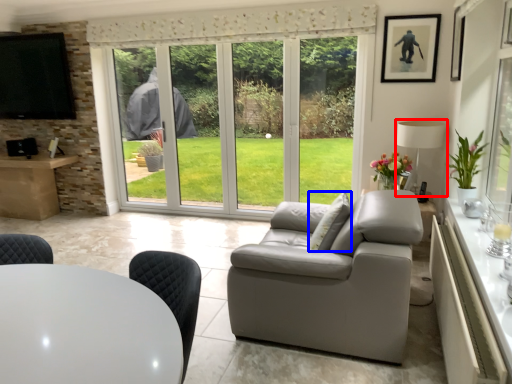
Question: Which point is closer to the camera, lamp (highlighted by a red box) or pillow (highlighted by a blue box)?

Choices:
 (A) lamp
 (B) pillow

Answer: (B)